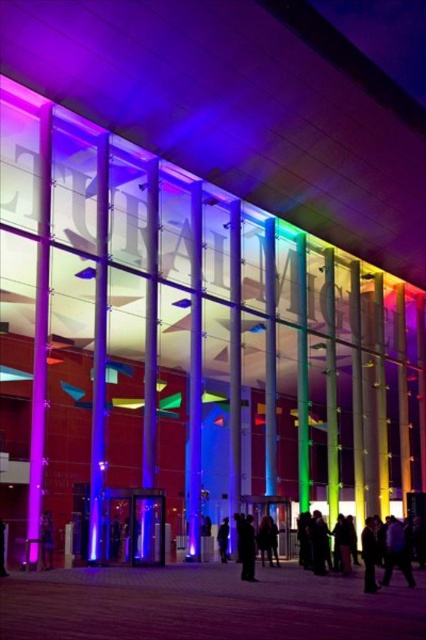
Question: Is black matte coat at center in front of black leather jacket at lower left?

Choices:
 (A) no
 (B) yes

Answer: (B)

Question: Which of the following is the farthest from the observer?

Choices:
 (A) black matte coat at center
 (B) black leather jacket at lower left

Answer: (B)

Question: Can you confirm if black matte coat at center is bigger than black fabric at center?

Choices:
 (A) yes
 (B) no

Answer: (A)

Question: Which point is closer to the camera?

Choices:
 (A) black fabric at center
 (B) black matte coat at center
 (C) black leather jacket at lower left

Answer: (B)

Question: Is black leather jacket at lower left positioned behind black fabric at center?

Choices:
 (A) yes
 (B) no

Answer: (B)

Question: Which point appears farthest from the camera in this image?

Choices:
 (A) coord(48,550)
 (B) coord(241,576)

Answer: (A)